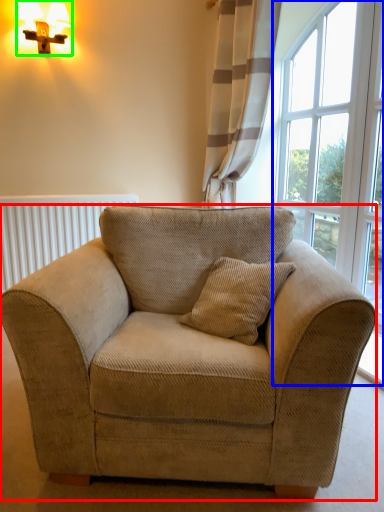
Question: Based on their relative distances, which object is nearer to studio couch (highlighted by a red box)? Choose from window (highlighted by a blue box) and table lamp (highlighted by a green box).

Choices:
 (A) window
 (B) table lamp

Answer: (A)